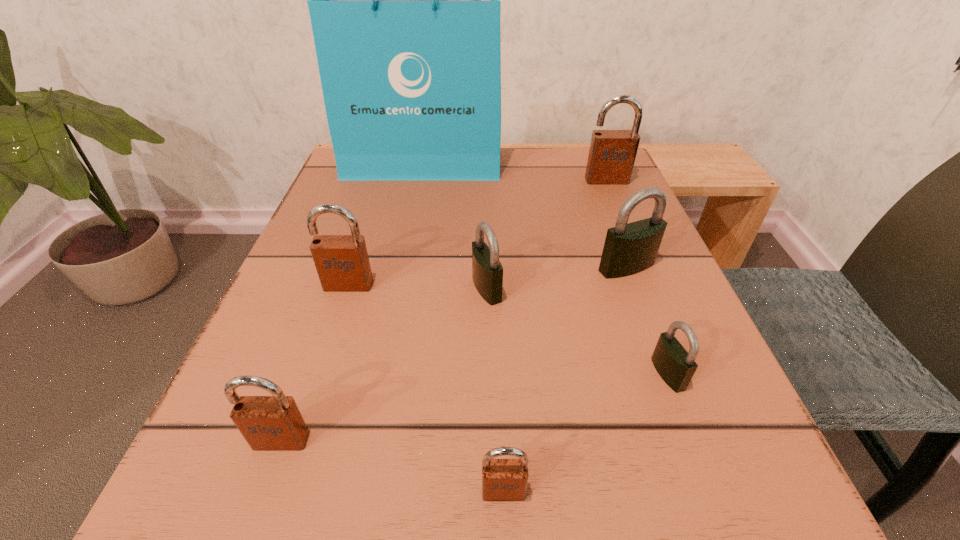
At what (x,y) coordinates should I click in order to perform the action: click on padlock that is at the far edge. Please return your answer as a coordinate pair (x, y). Image resolution: width=960 pixels, height=540 pixels. Looking at the image, I should click on (612, 153).

In order to click on object situated at the near edge in this screenshot , I will do `click(502, 479)`.

Identify the location of shopping bag that is positioned at the left edge. This screenshot has width=960, height=540. (404, 0).

You are a GUI agent. You are given a task and a screenshot of the screen. Output one action in this format:
    pyautogui.click(x=<x>, y=<y>)
    Task: Click on the object at the far left corner
    
    Given the screenshot: What is the action you would take?
    [x=404, y=0]

Identify the location of object located in the far right corner section of the desktop. (612, 153).

Locate an element on the screen. The height and width of the screenshot is (540, 960). vacant space at the far edge of the desktop is located at coordinates (540, 150).

This screenshot has height=540, width=960. Identify the location of vacant area at the near edge. (617, 523).

Locate an element on the screen. The height and width of the screenshot is (540, 960). vacant space at the left edge of the desktop is located at coordinates (310, 319).

Identify the location of free region at the right edge of the desktop. The width and height of the screenshot is (960, 540). (634, 336).

Where is `free space at the far left corner of the desktop`? This screenshot has height=540, width=960. free space at the far left corner of the desktop is located at coordinates (407, 186).